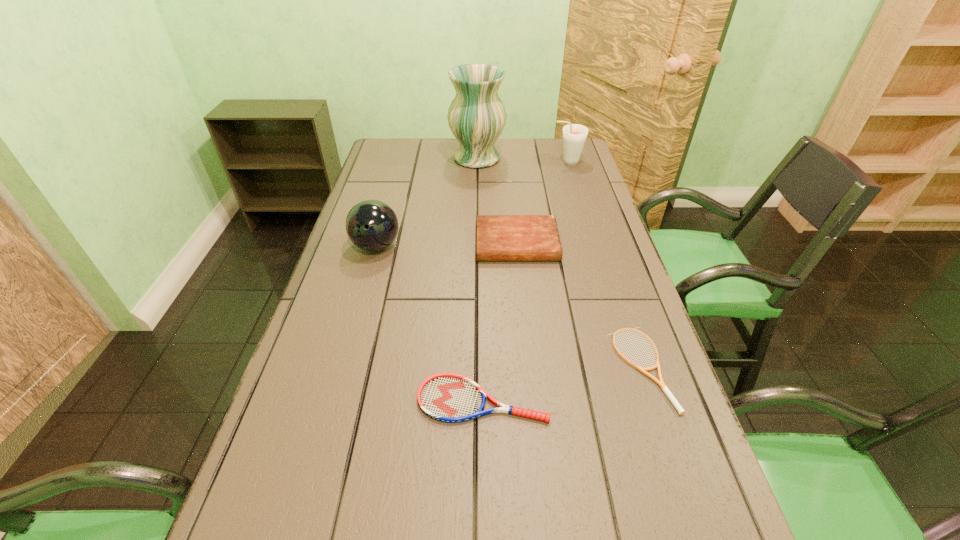
Where is `vacant point located between the bowling ball and the third shortest object`? Image resolution: width=960 pixels, height=540 pixels. vacant point located between the bowling ball and the third shortest object is located at coordinates (446, 245).

Locate an element on the screen. Image resolution: width=960 pixels, height=540 pixels. vacant area that lies between the shorter tennis racket and the vase is located at coordinates (559, 264).

At what (x,y) coordinates should I click in order to perform the action: click on free point between the tallest object and the leftmost object. Please return your answer as a coordinate pair (x, y). The image size is (960, 540). Looking at the image, I should click on (427, 202).

This screenshot has height=540, width=960. I want to click on unoccupied position between the Bible and the second shortest object, so click(x=500, y=322).

You are a GUI agent. You are given a task and a screenshot of the screen. Output one action in this format:
    pyautogui.click(x=<x>, y=<y>)
    Task: Click on the unoccupied position between the fifth tallest object and the root beer
    This screenshot has width=960, height=540.
    Given the screenshot: What is the action you would take?
    pyautogui.click(x=525, y=281)

Locate an element on the screen. empty space that is in between the right tennis racket and the root beer is located at coordinates (604, 265).

Identify which object is the closest to the shortest object. Please provide its 2D coordinates. Your answer should be formatted as a tuple, i.e. [(x, y)], where the tuple contains the x and y coordinates of a point satisfying the conditions above.

[(447, 397)]

I want to click on object that ranks as the closest to the vase, so click(x=574, y=135).

The width and height of the screenshot is (960, 540). Identify the location of vacant area that satisfies the following two spatial constraints: 1. on the side of the left tennis racket with the finger holes; 2. on the left side of the leftmost object. (333, 400).

Find the location of a particular element. free space that satisfies the following two spatial constraints: 1. on the drink side of the root beer; 2. on the side of the bowling ball with the finger holes is located at coordinates (593, 246).